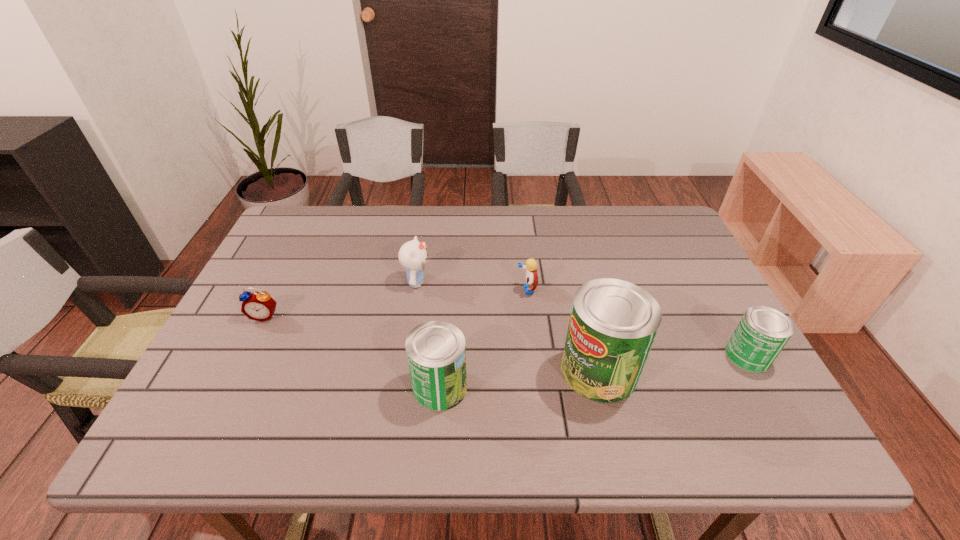
This screenshot has height=540, width=960. In order to click on vacant space located 0.320m on the left of the second object from right to left in this screenshot , I will do `click(420, 371)`.

The width and height of the screenshot is (960, 540). I want to click on free region located 0.090m on the front of the rightmost can, so click(777, 408).

At what (x,y) coordinates should I click in order to perform the action: click on vacant region located 0.090m on the front-facing side of the Lego. Please return your answer as a coordinate pair (x, y). The width and height of the screenshot is (960, 540). Looking at the image, I should click on (484, 289).

Identify the location of vacant space located on the front-facing side of the Lego. This screenshot has height=540, width=960. (461, 289).

At what (x,y) coordinates should I click in order to perform the action: click on vacant space located on the front-facing side of the Lego. Please return your answer as a coordinate pair (x, y). This screenshot has width=960, height=540. Looking at the image, I should click on (476, 289).

This screenshot has width=960, height=540. I want to click on free space located on the front-facing side of the fourth nearest object, so click(x=220, y=408).

Locate an element on the screen. vacant position located 0.240m on the front-facing side of the kitten is located at coordinates (517, 282).

Find the location of a particular element. The height and width of the screenshot is (540, 960). object that is at the left edge is located at coordinates (259, 306).

This screenshot has height=540, width=960. Identify the location of object positioned at the right edge. (761, 334).

Image resolution: width=960 pixels, height=540 pixels. In the image, there is a desktop. In order to click on free space at the far edge in this screenshot , I will do `click(410, 206)`.